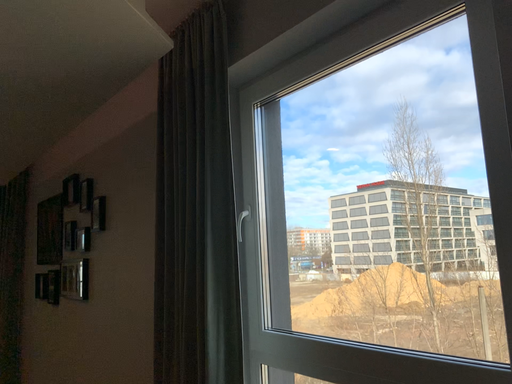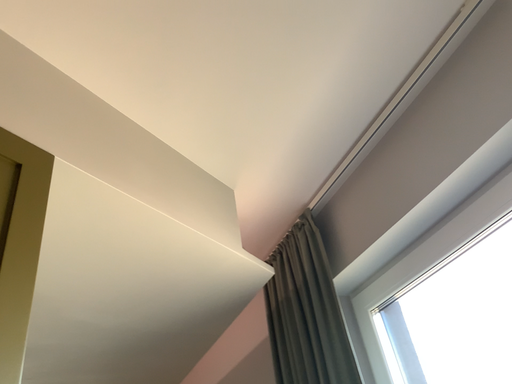
Question: How did the camera likely rotate when shooting the video?

Choices:
 (A) rotated downward
 (B) rotated upward

Answer: (B)